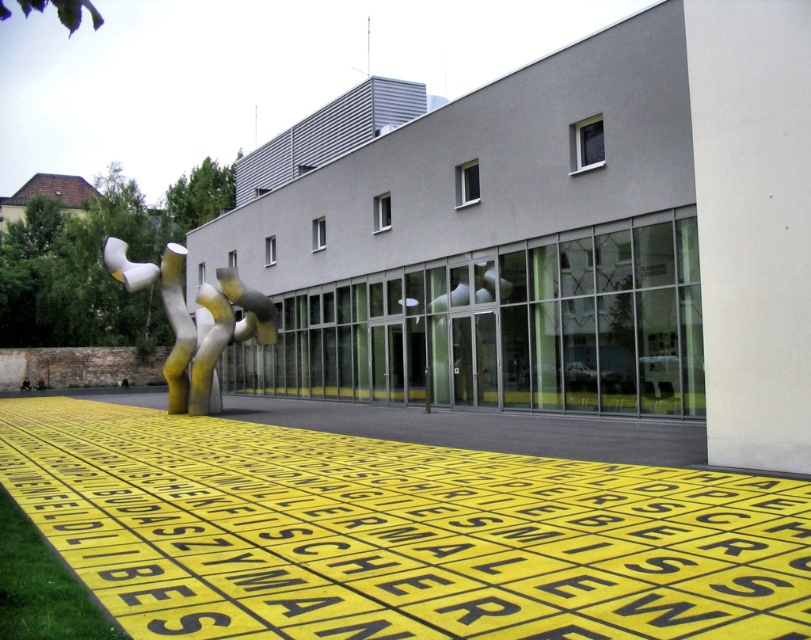
You are standing in front of the modern building and want to take a photo of the polished stainless steel sculpture at center without the yellow plastic sign at lower center blocking the view. Is this possible?

The yellow plastic sign at lower center is in front of the polished stainless steel sculpture at center, so you will need to move to a position where the sign is not between you and the sculpture to avoid it blocking the view.